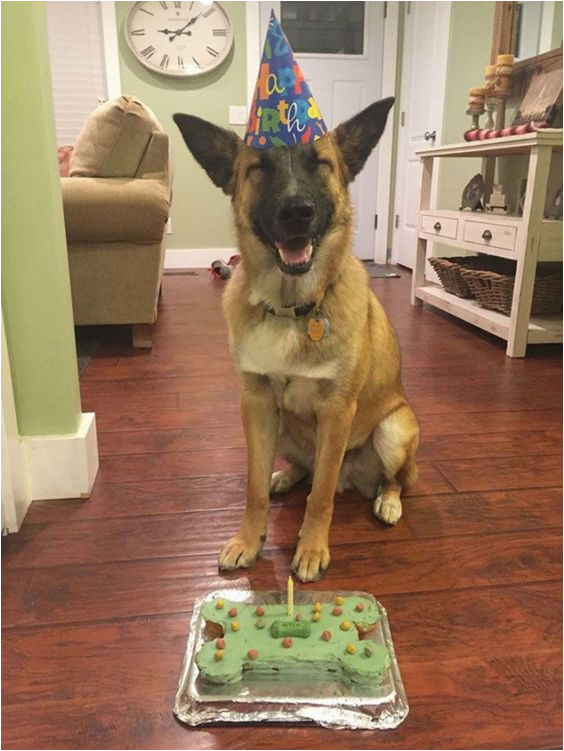
Locate an element on the screen. This screenshot has width=564, height=751. floor is located at coordinates (466, 513).